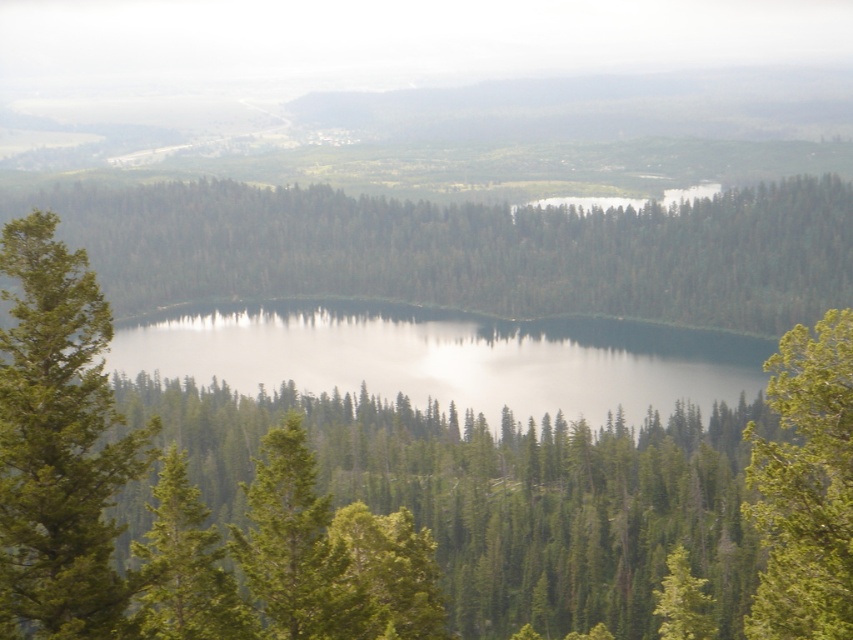
Is green textured tree at center smaller than green textured tree at lower left?

Incorrect, green textured tree at center is not smaller in size than green textured tree at lower left.

Does green textured tree at center have a greater height compared to green textured tree at lower left?

Yes.

This screenshot has width=853, height=640. I want to click on green textured tree at center, so click(294, 547).

Which of these two, shiny dark blue water at center or green leafy tree at right, stands shorter?

shiny dark blue water at center

Does shiny dark blue water at center have a lesser height compared to green leafy tree at right?

Yes, shiny dark blue water at center is shorter than green leafy tree at right.

Which is in front, point (357, 308) or point (761, 513)?

Point (761, 513)

Where is `shiny dark blue water at center`? shiny dark blue water at center is located at coordinates (448, 356).

Who is positioned more to the right, green leafy tree at left or green textured tree at lower left?

From the viewer's perspective, green textured tree at lower left appears more on the right side.

From the picture: Does green leafy tree at left have a greater height compared to green textured tree at lower left?

Indeed, green leafy tree at left has a greater height compared to green textured tree at lower left.

Where is `green leafy tree at left`? green leafy tree at left is located at coordinates (57, 444).

Locate an element on the screen. Image resolution: width=853 pixels, height=640 pixels. green leafy tree at left is located at coordinates pyautogui.click(x=57, y=444).